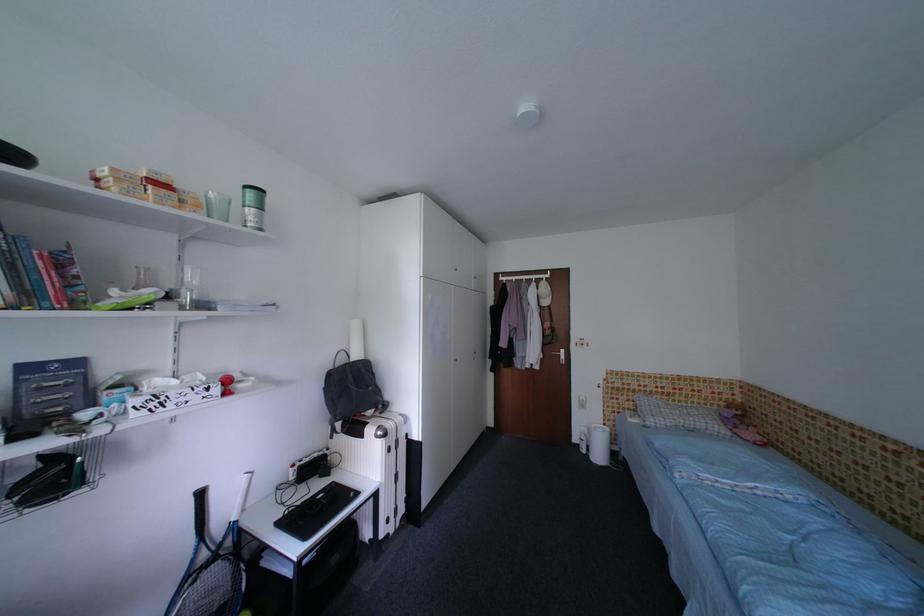
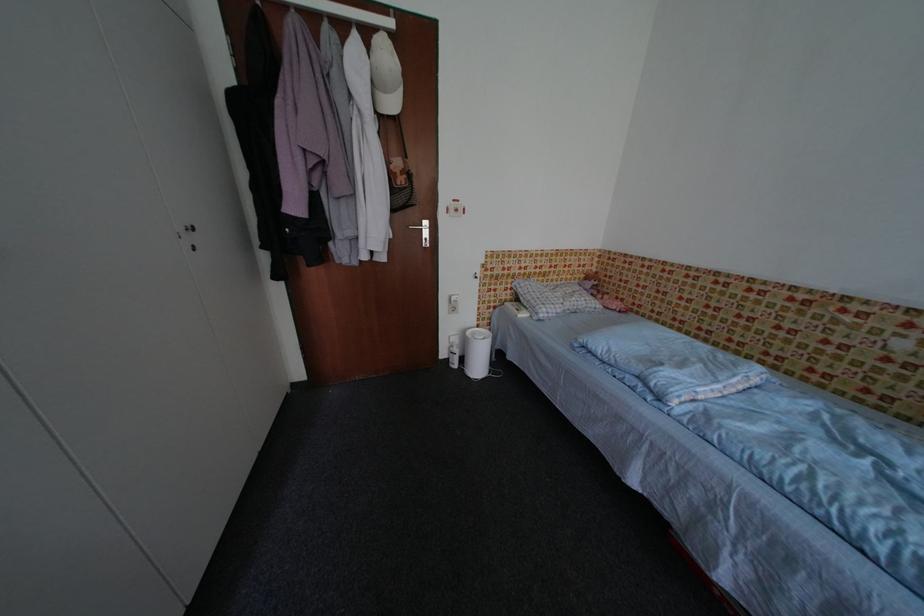
In the second image, find the point that corresponds to (637,411) in the first image.

(514, 302)